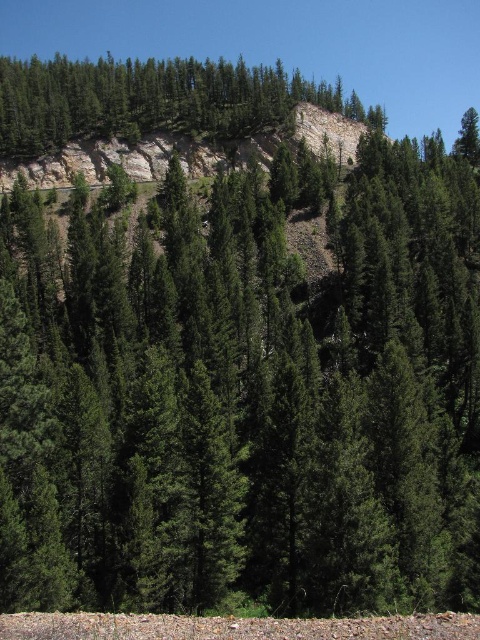
Question: Does green textured rock at upper center have a greater width compared to rustic stone cliff at upper center?

Choices:
 (A) no
 (B) yes

Answer: (B)

Question: Is green textured rock at upper center to the left of rustic stone cliff at upper center from the viewer's perspective?

Choices:
 (A) yes
 (B) no

Answer: (B)

Question: Can you confirm if green textured rock at upper center is positioned to the left of rustic stone cliff at upper center?

Choices:
 (A) no
 (B) yes

Answer: (A)

Question: Which object is farther from the camera taking this photo?

Choices:
 (A) rustic stone cliff at upper center
 (B) green textured rock at upper center

Answer: (B)